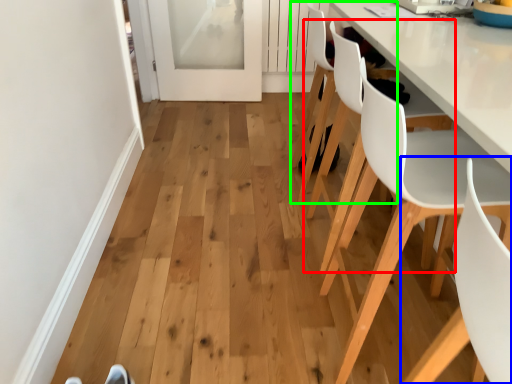
Question: Which is nearer to the chair (highlighted by a red box)? chair (highlighted by a blue box) or chair (highlighted by a green box).

Choices:
 (A) chair
 (B) chair

Answer: (B)